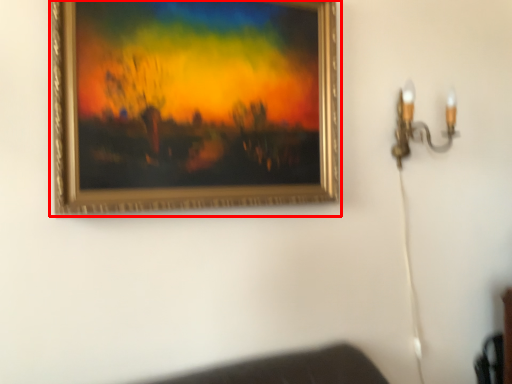
Question: Where is picture frame (annotated by the red box) located in relation to lamp in the image?

Choices:
 (A) right
 (B) left

Answer: (B)